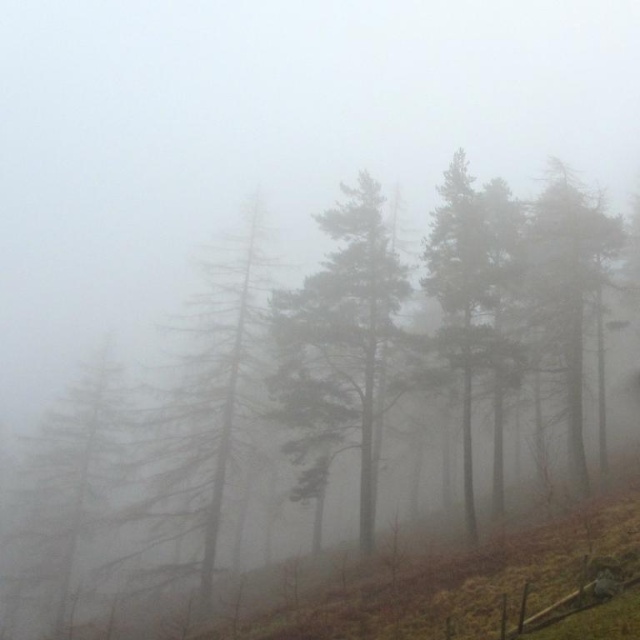
Does green matte tree at center have a greater height compared to green textured pine tree at center?

Yes, green matte tree at center is taller than green textured pine tree at center.

Is green matte tree at center thinner than green textured pine tree at center?

Yes, green matte tree at center is thinner than green textured pine tree at center.

Measure the distance between point (320, 426) and camera.

Point (320, 426) and camera are 108.42 feet apart.

Find the location of `green matte tree at center`. green matte tree at center is located at coordinates (339, 346).

Who is positioned more to the right, green textured pine tree at left or green matte tree at right?

green matte tree at right

From the picture: Is the position of green textured pine tree at left less distant than that of green matte tree at right?

No, it is not.

Image resolution: width=640 pixels, height=640 pixels. I want to click on green textured pine tree at left, so click(61, 499).

Which is more to the left, smooth green tree at center or green matte tree at right?

From the viewer's perspective, smooth green tree at center appears more on the left side.

Between smooth green tree at center and green matte tree at right, which one is positioned higher?

Positioned higher is green matte tree at right.

Describe the element at coordinates (472, 300) in the screenshot. I see `smooth green tree at center` at that location.

In order to click on smooth green tree at center in this screenshot , I will do `click(472, 300)`.